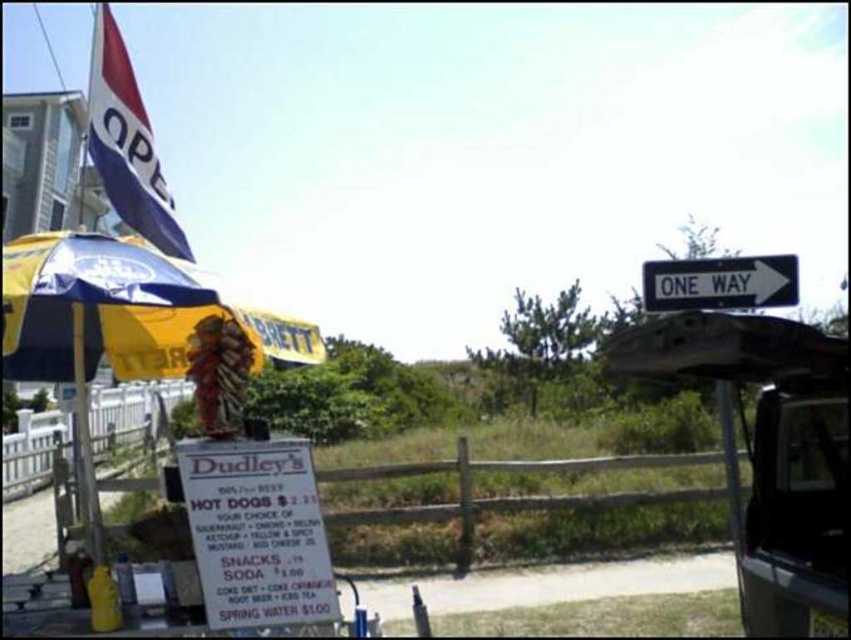
Who is higher up, blue and white striped flag at upper left or yellow matte pole at left?

blue and white striped flag at upper left

Between point (101, 49) and point (78, 432), which one is positioned behind?

Point (78, 432)

What are the coordinates of `blue and white striped flag at upper left` in the screenshot? It's located at (126, 141).

This screenshot has height=640, width=851. What are the coordinates of `yellow/blue fabric umbrella at left` in the screenshot? It's located at (96, 320).

Who is taller, yellow/blue fabric umbrella at left or blue and white striped flag at upper left?

blue and white striped flag at upper left is taller.

Measure the distance between point (167,307) and camera.

Point (167,307) and camera are 2.77 meters apart from each other.

Find the location of a particular element. The height and width of the screenshot is (640, 851). yellow/blue fabric umbrella at left is located at coordinates (96, 320).

Is point (244, 560) more distant than point (740, 282)?

No, (244, 560) is in front of (740, 282).

Between point (223, 493) and point (768, 280), which one is positioned in front?

Positioned in front is point (223, 493).

Who is more distant from viewer, (x=224, y=538) or (x=789, y=275)?

The point (x=789, y=275) is behind.

Where is `wooden signboard at lower center`? This screenshot has height=640, width=851. wooden signboard at lower center is located at coordinates (256, 532).